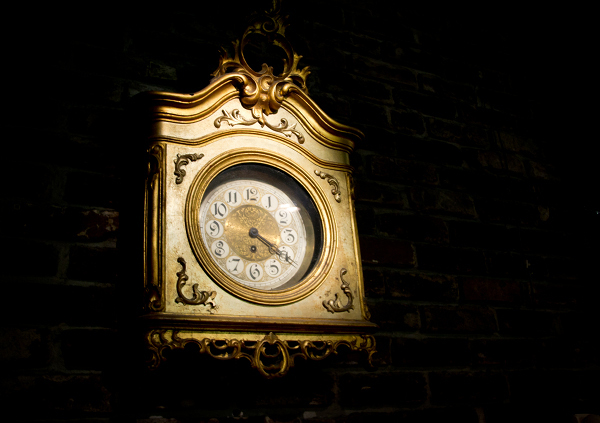
You are a GUI agent. You are given a task and a screenshot of the screen. Output one action in this format:
    pyautogui.click(x=<x>, y=<y>)
    Task: Click on the space above wall clock
    This screenshot has width=600, height=423.
    Given the screenshot: What is the action you would take?
    click(254, 17), click(257, 146)